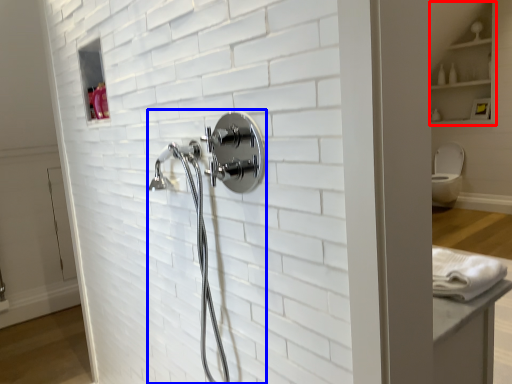
Question: Which point is further to the camera, cabinet (highlighted by a red box) or shower (highlighted by a blue box)?

Choices:
 (A) cabinet
 (B) shower

Answer: (A)